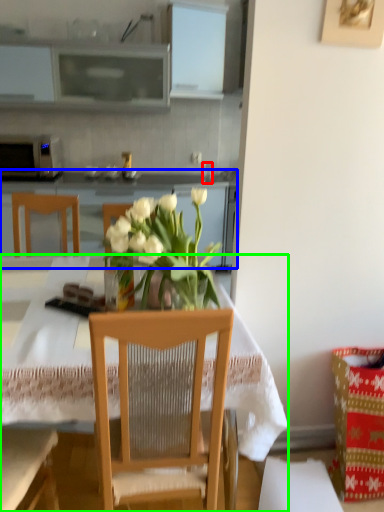
Question: Which object is the farthest from coffee cup (highlighted by a red box)? Choose among these: cabinetry (highlighted by a blue box) or desk (highlighted by a green box).

Choices:
 (A) cabinetry
 (B) desk

Answer: (B)